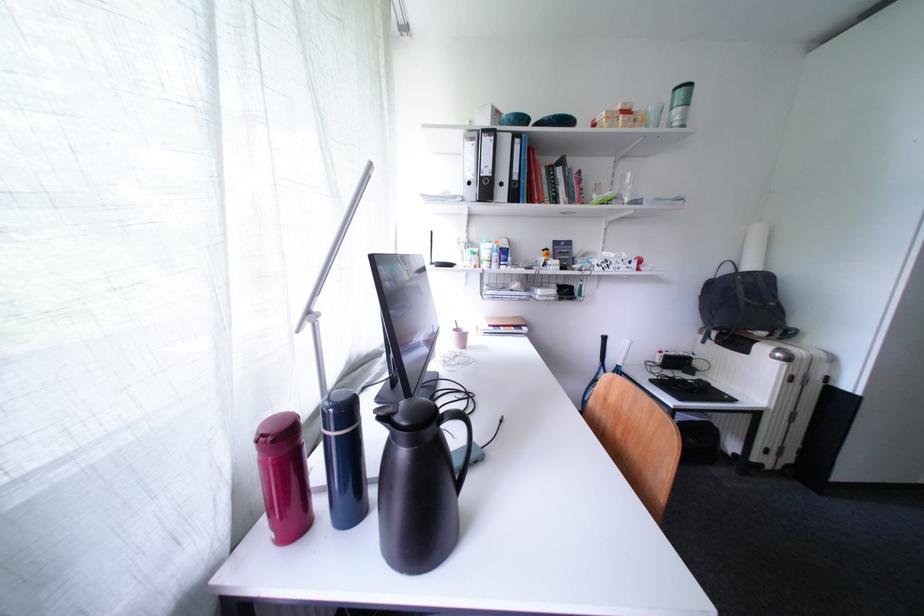
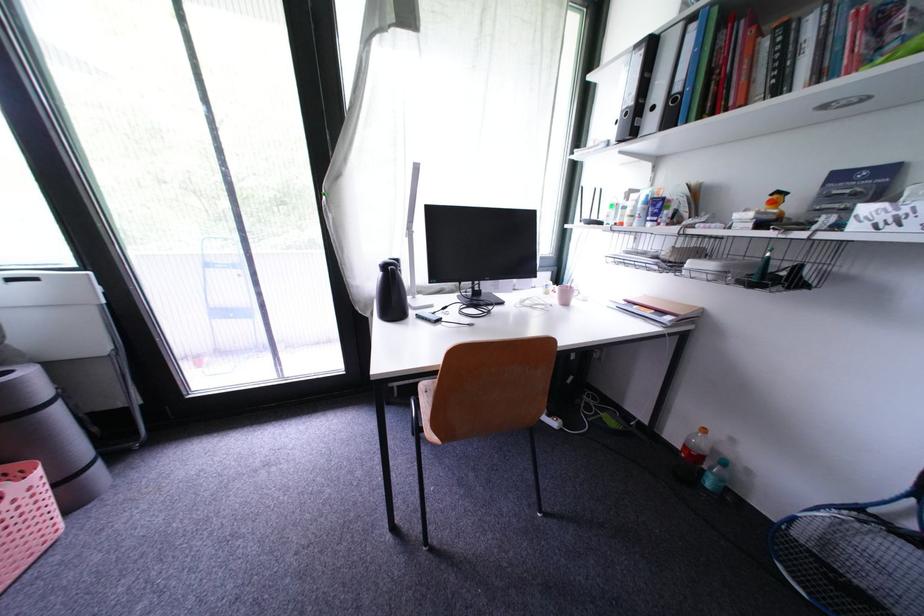
Question: I am providing you with two images of the same scene from different viewpoints. After the viewpoint changes to image2, which objects are now occluded?

Choices:
 (A) orange cap bottle
 (B) black thermos handle
 (C) black ring binder
 (D) none of these

Answer: (D)